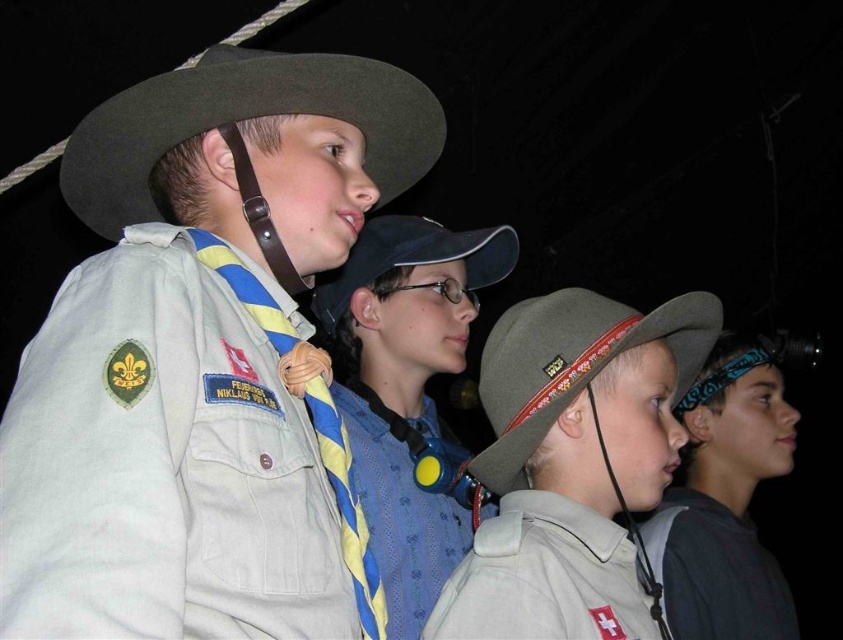
Is blue fabric headband at right below white cotton shirt at lower right?

No.

Measure the distance between blue fabric headband at right and camera.

5.64 feet

I want to click on blue fabric headband at right, so click(725, 500).

Is blue striped necktie at center positioned at the back of matte brown cowboy hat at center?

No.

Does blue striped necktie at center have a greater width compared to matte brown cowboy hat at center?

No, blue striped necktie at center is not wider than matte brown cowboy hat at center.

Is point (439, 557) farther from camera compared to point (503, 250)?

No.

Locate an element on the screen. The image size is (843, 640). blue striped necktie at center is located at coordinates (407, 388).

Is blue striped necktie at center positioned at the back of white matte uniform at center?

Yes, blue striped necktie at center is behind white matte uniform at center.

What do you see at coordinates (407, 388) in the screenshot? The height and width of the screenshot is (640, 843). I see `blue striped necktie at center` at bounding box center [407, 388].

Identify the location of blue striped necktie at center. The height and width of the screenshot is (640, 843). (407, 388).